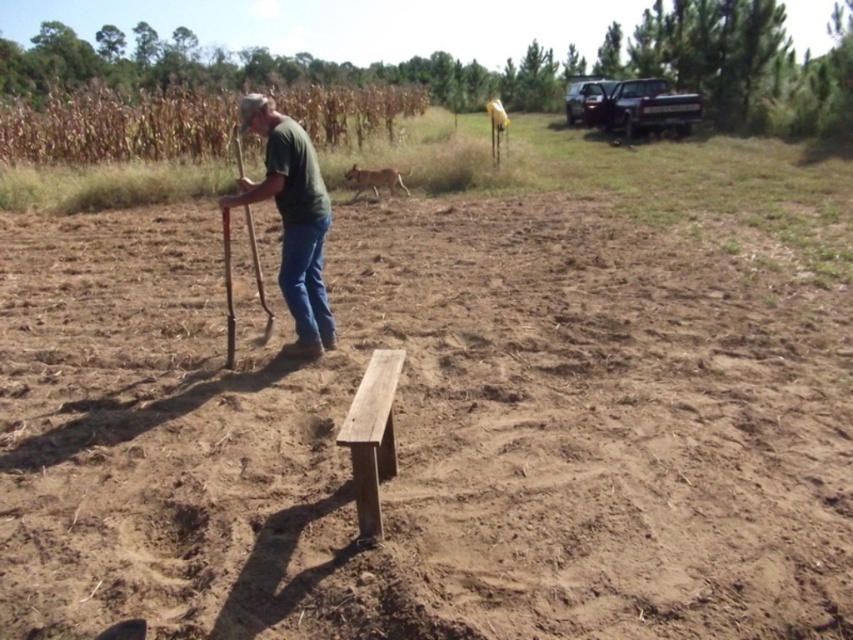
Is green matte shirt at center to the right of smooth brown bench at center from the viewer's perspective?

Incorrect, green matte shirt at center is not on the right side of smooth brown bench at center.

Between point (306, 301) and point (386, 396), which one is positioned behind?

Point (306, 301)

Identify the location of green matte shirt at center. The image size is (853, 640). (292, 220).

Between green matte shirt at center and blue denim jeans at center, which one is positioned higher?

Positioned higher is blue denim jeans at center.

Which is below, green matte shirt at center or blue denim jeans at center?

green matte shirt at center is lower down.

The height and width of the screenshot is (640, 853). Find the location of `green matte shirt at center`. green matte shirt at center is located at coordinates (292, 220).

Locate an element on the screen. The image size is (853, 640). brown rough dirt at center is located at coordinates (426, 433).

How much distance is there between brown rough dirt at center and green matte shirt at center?

brown rough dirt at center is 2.34 meters away from green matte shirt at center.

Which is behind, point (548, 230) or point (329, 342)?

Positioned behind is point (548, 230).

Identify the location of brown rough dirt at center. (426, 433).